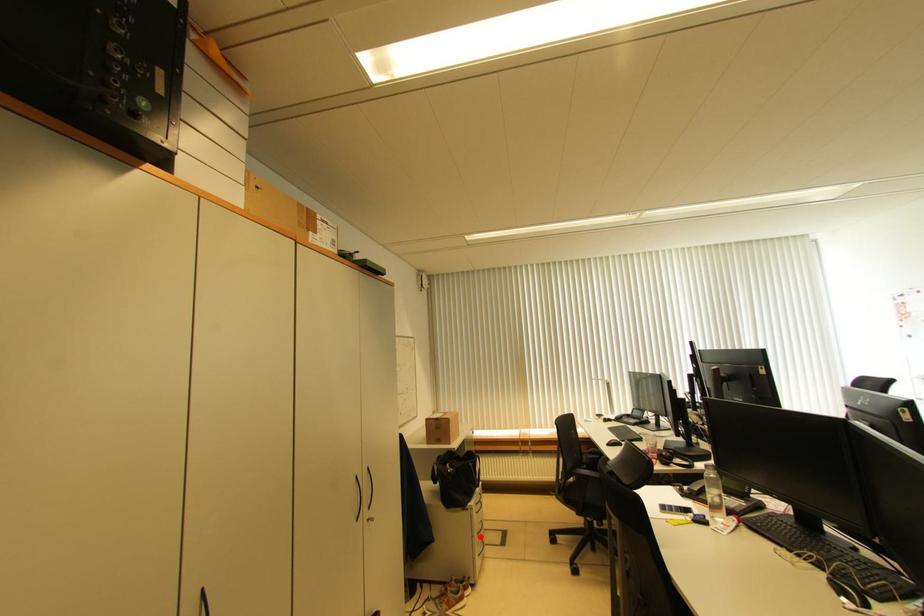
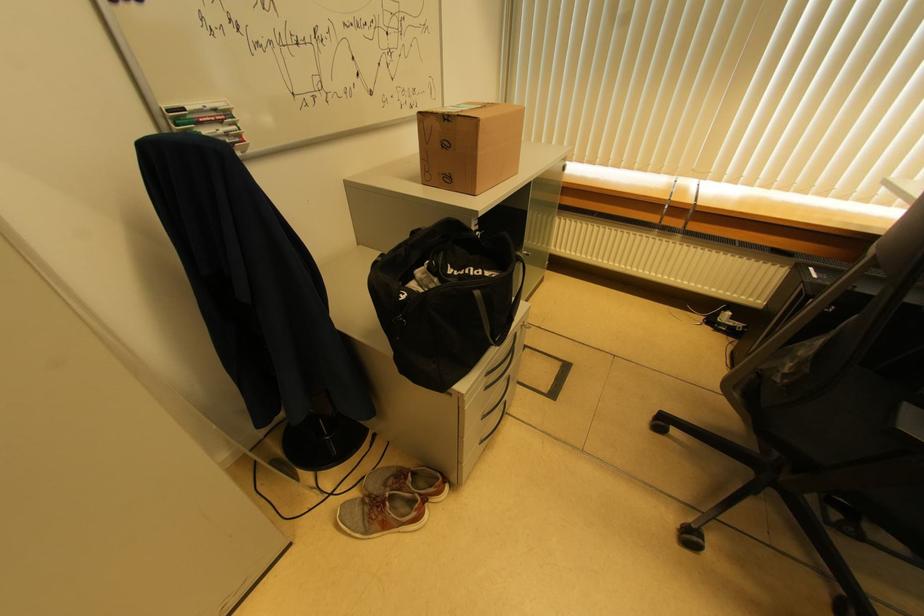
In the second image, find the point that corresponds to the highlighted location in the first image.

(485, 419)